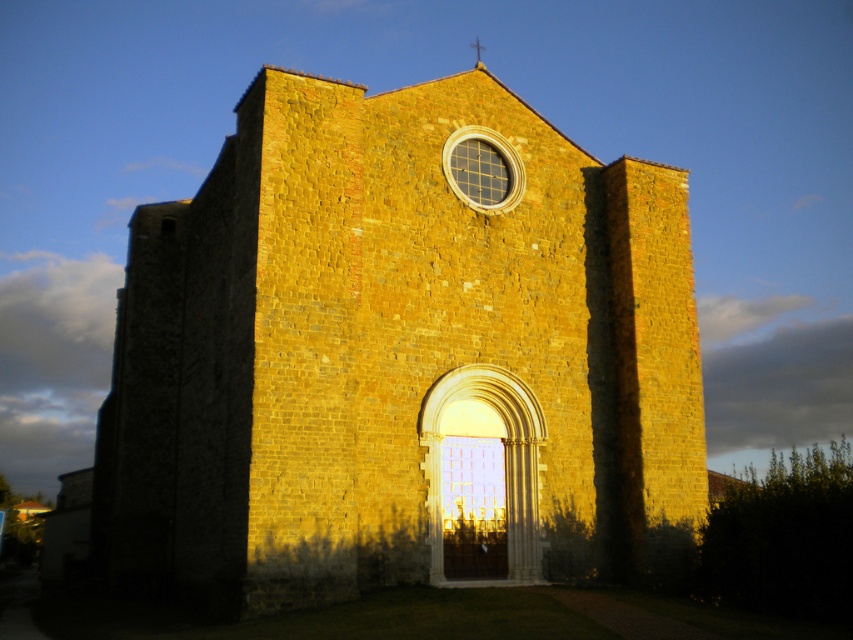
You are standing in a park and see the yellow stone church at center in the distance. If you want to take a photo of the church with your smartphone camera, which has a maximum zoom range of 10 meters, will you be able to capture the entire church without moving closer?

The yellow stone church at center is 33.98 meters away from the camera. Since the smartphone camera has a maximum zoom range of 10 meters, you will not be able to capture the entire church without moving closer.

You are standing in front of a historic stone church. You notice a point at coordinates (399, 355). Is this point the location of the yellow stone church at center?

Yes, the yellow stone church at center is located at point (399, 355).

You are standing in front of the yellow stone church at center. You notice the metallic cross at upper center. Which object is taller?

The yellow stone church at center is taller than the metallic cross at upper center.